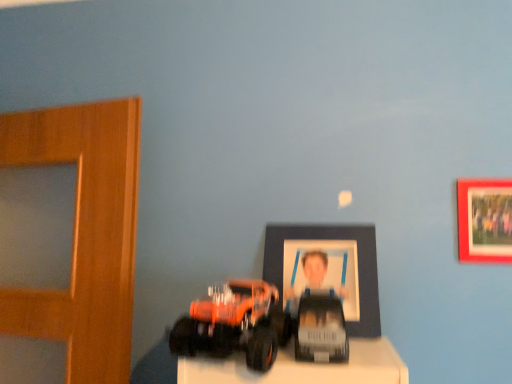
Question: In the image, is matte red picture frame at upper right, which is the first picture frame from right to left, on the left side or the right side of orange matte truck at lower left, which is the 2th toy from right to left?

Choices:
 (A) left
 (B) right

Answer: (B)

Question: From the image's perspective, is matte red picture frame at upper right, which is the first picture frame from right to left, positioned above or below orange matte truck at lower left, which ranks as the 1th toy in left-to-right order?

Choices:
 (A) below
 (B) above

Answer: (B)

Question: Which of these objects is positioned closest to the matte red picture frame at upper right, which is the 2th picture frame in left-to-right order?

Choices:
 (A) matte plastic picture frame at center, placed as the 1th picture frame when sorted from left to right
 (B) shiny metallic car at center, the 1th toy in the right-to-left sequence
 (C) orange matte truck at lower left, which ranks as the 1th toy in left-to-right order

Answer: (A)

Question: Which object is the closest to the shiny metallic car at center, positioned as the 2th toy in left-to-right order?

Choices:
 (A) orange matte truck at lower left, which ranks as the 1th toy in left-to-right order
 (B) matte plastic picture frame at center, which is the 2th picture frame from right to left
 (C) matte red picture frame at upper right, which is the 2th picture frame in left-to-right order

Answer: (A)